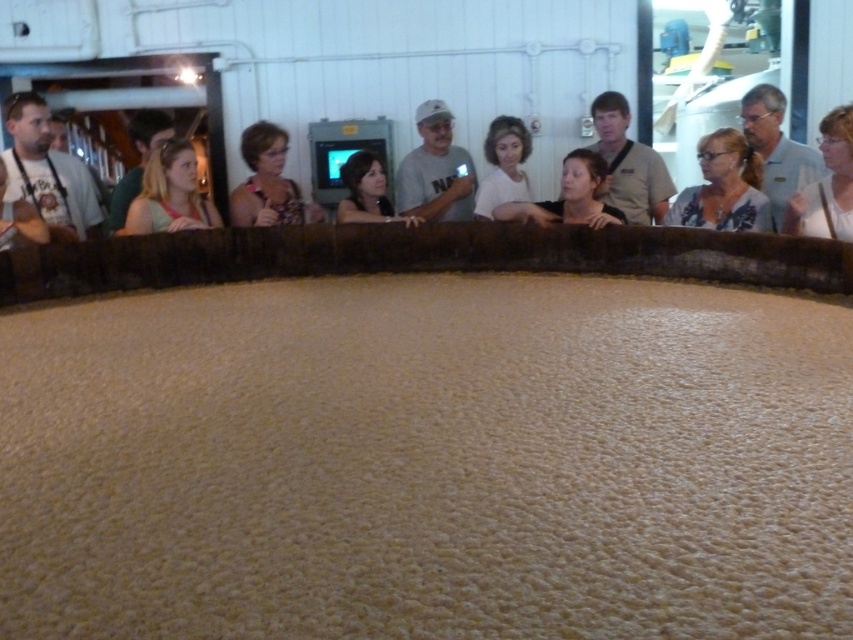
Can you confirm if blonde hair at center is taller than white matte shirt at center?

In fact, blonde hair at center may be shorter than white matte shirt at center.

Which of these two, blonde hair at center or white matte shirt at center, stands shorter?

blonde hair at center is shorter.

Locate an element on the screen. This screenshot has height=640, width=853. blonde hair at center is located at coordinates (169, 193).

This screenshot has height=640, width=853. I want to click on blonde hair at center, so click(169, 193).

In the scene shown: Which is more to the right, white floral blouse at upper center or matte black shirt at center?

white floral blouse at upper center is more to the right.

Which of these two, white floral blouse at upper center or matte black shirt at center, stands shorter?

white floral blouse at upper center

Who is more forward, (688, 205) or (270, 125)?

Point (688, 205) is in front.

At what (x,y) coordinates should I click in order to perform the action: click on white floral blouse at upper center. Please return your answer as a coordinate pair (x, y). Looking at the image, I should click on (724, 188).

Does blonde hair at center appear under black fabric at center?

No.

Does blonde hair at center have a lesser width compared to black fabric at center?

Correct, blonde hair at center's width is less than black fabric at center's.

Between point (154, 176) and point (605, 221), which one is positioned behind?

The point (154, 176) is more distant.

The width and height of the screenshot is (853, 640). Find the location of `blonde hair at center`. blonde hair at center is located at coordinates (169, 193).